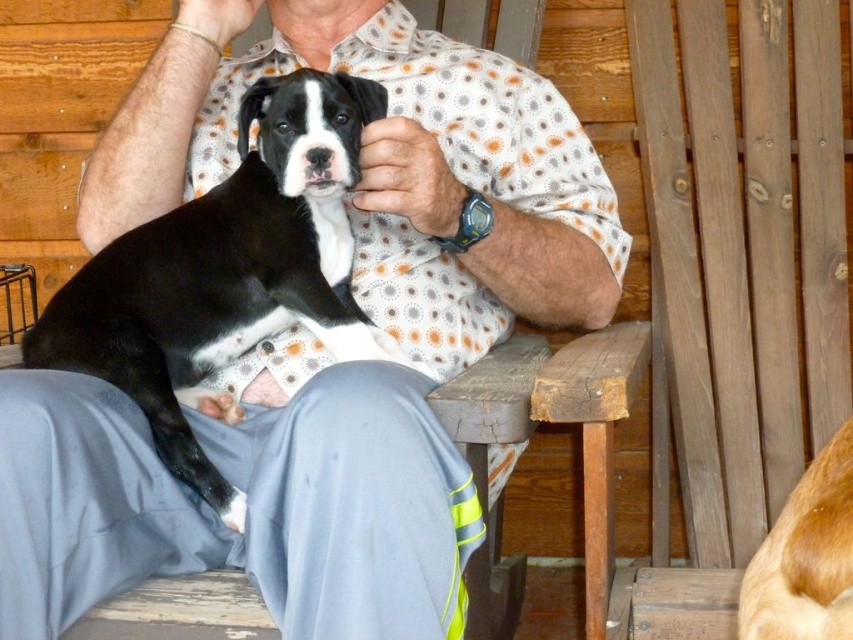
Between point (750, 144) and point (308, 140), which one is positioned behind?

The point (750, 144) is more distant.

Is wooden slats chair at right positioned in front of black smooth fur at center?

No.

Does point (775, 356) lie in front of point (276, 216)?

That is False.

In order to click on wooden slats chair at right in this screenshot , I will do click(x=740, y=269).

Between matte black shirt at center and golden fur dog at lower right, which one has more height?

Standing taller between the two is matte black shirt at center.

Is point (178, 10) farther from viewer compared to point (822, 614)?

Yes, point (178, 10) is behind point (822, 614).

What do you see at coordinates (248, 496) in the screenshot? I see `matte black shirt at center` at bounding box center [248, 496].

Where is `matte black shirt at center`? matte black shirt at center is located at coordinates (248, 496).

Is matte black shirt at center thinner than wooden slats chair at right?

Incorrect, matte black shirt at center's width is not less than wooden slats chair at right's.

Does matte black shirt at center have a lesser height compared to wooden slats chair at right?

Yes, matte black shirt at center is shorter than wooden slats chair at right.

Between point (126, 481) and point (825, 134), which one is positioned behind?

Positioned behind is point (825, 134).

This screenshot has width=853, height=640. What are the coordinates of `matte black shirt at center` in the screenshot? It's located at (248, 496).